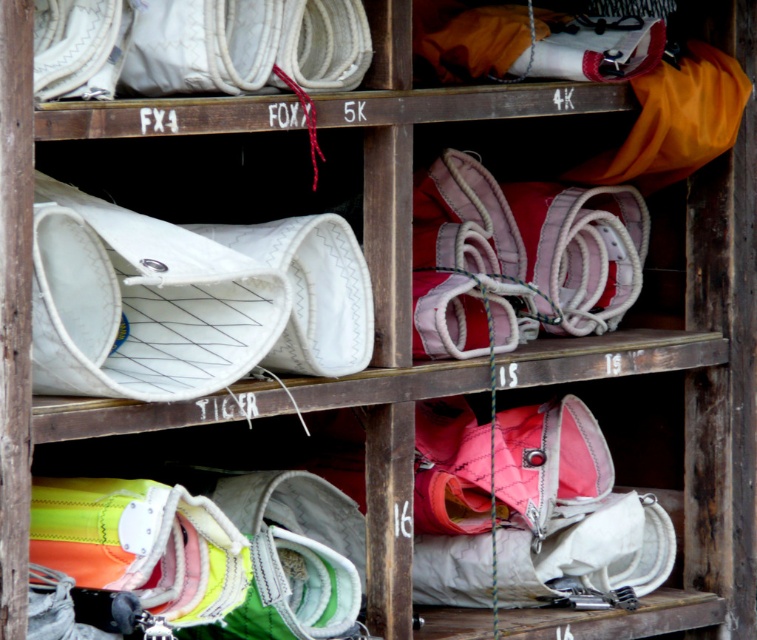
Question: Is pink fabric shoe at center in front of white fabric shoe at center?

Choices:
 (A) no
 (B) yes

Answer: (A)

Question: Can you confirm if pink fabric shoe at center is smaller than white fabric shoe at center?

Choices:
 (A) yes
 (B) no

Answer: (B)

Question: Does pink fabric shoe at center come behind white fabric shoe at center?

Choices:
 (A) yes
 (B) no

Answer: (A)

Question: Which object is closer to the camera taking this photo?

Choices:
 (A) pink fabric shoe at center
 (B) white fabric shoe at center

Answer: (B)

Question: Which object is closer to the camera taking this photo?

Choices:
 (A) pink fabric shoe at center
 (B) white fabric shoe at center

Answer: (B)

Question: Among these objects, which one is farthest from the camera?

Choices:
 (A) pink fabric shoe at center
 (B) white fabric shoe at center

Answer: (A)